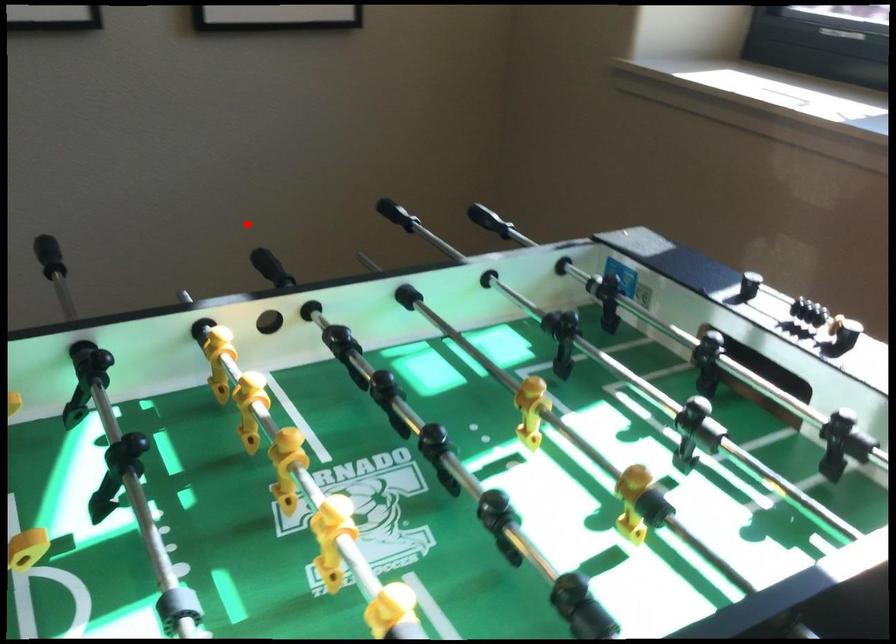
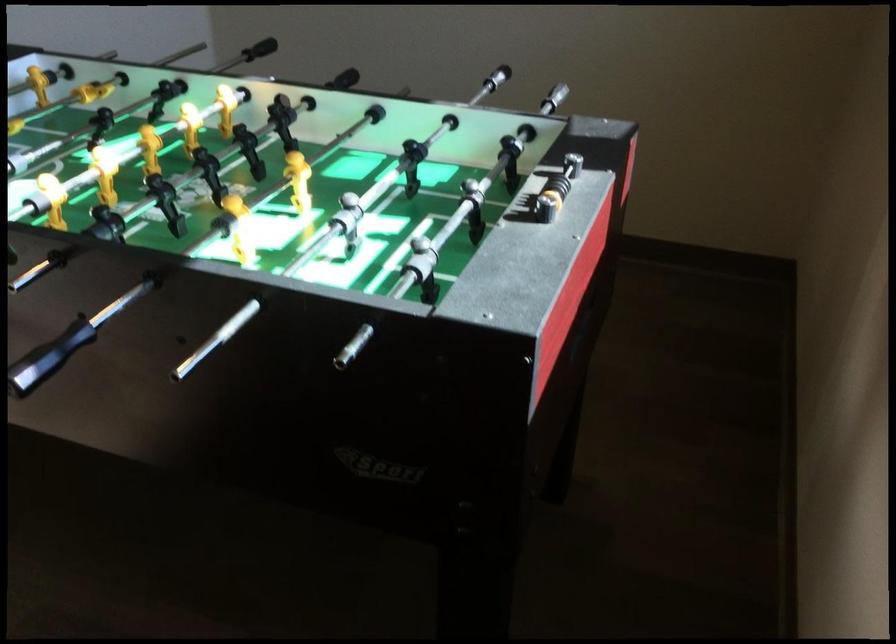
Question: I am providing you with two images of the same scene from different viewpoints. Given a red point in image1, look at the same physical point in image2. Is it:

Choices:
 (A) Closer to the viewpoint
 (B) Farther from the viewpoint

Answer: (B)